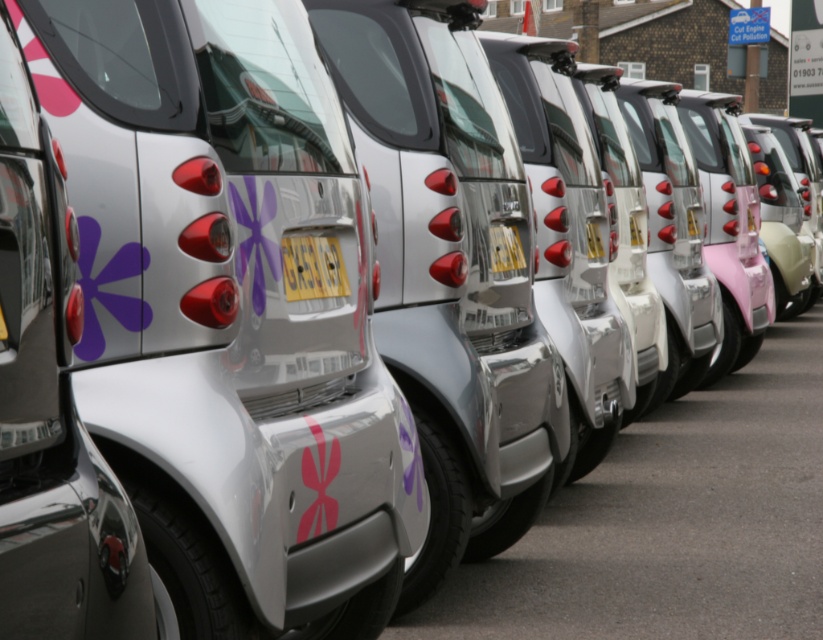
Question: Which point is closer to the camera?

Choices:
 (A) metallic silver car at center
 (B) yellow matte license plate at center

Answer: (A)

Question: Among these objects, which one is nearest to the camera?

Choices:
 (A) yellow matte license plate at center
 (B) metallic silver car at center

Answer: (B)

Question: Among these points, which one is farthest from the camera?

Choices:
 (A) (54, 540)
 (B) (310, 262)

Answer: (B)

Question: Is metallic silver car at center to the left of yellow matte license plate at center from the viewer's perspective?

Choices:
 (A) yes
 (B) no

Answer: (A)

Question: Is metallic silver car at center smaller than yellow matte license plate at center?

Choices:
 (A) yes
 (B) no

Answer: (B)

Question: Does metallic silver car at center appear under yellow matte license plate at center?

Choices:
 (A) yes
 (B) no

Answer: (A)